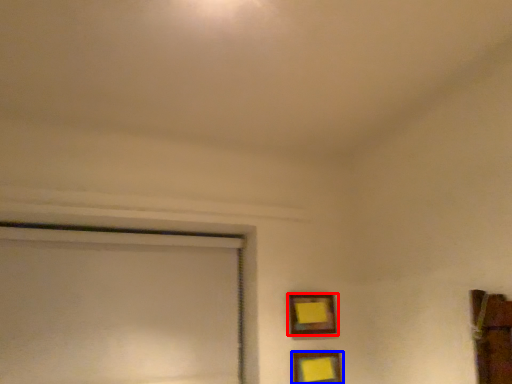
Question: Among these objects, which one is nearest to the camera, picture frame (highlighted by a red box) or picture frame (highlighted by a blue box)?

Choices:
 (A) picture frame
 (B) picture frame

Answer: (B)